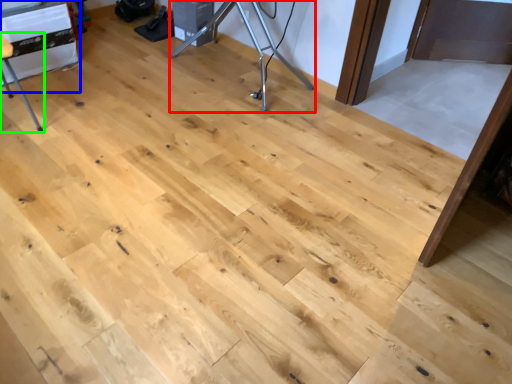
Question: Based on their relative distances, which object is farther from tripod (highlighted by a red box)? Choose from table (highlighted by a blue box) and furniture (highlighted by a green box).

Choices:
 (A) table
 (B) furniture

Answer: (B)